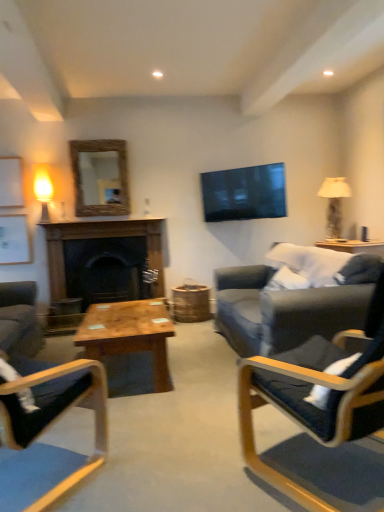
Locate an element on the screen. vacant area that is in front of wooden coffee table at center is located at coordinates (163, 417).